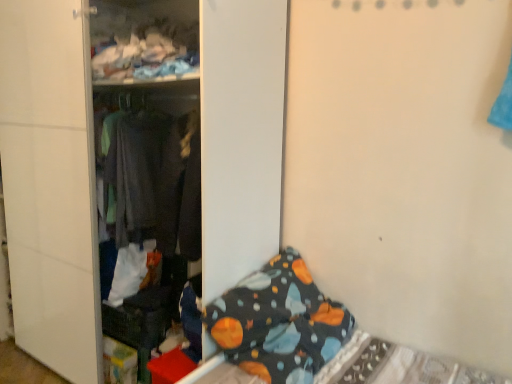
Question: From the image's perspective, is dark blue fabric bed at lower right located above dark blue fabric blanket at lower right?

Choices:
 (A) no
 (B) yes

Answer: (A)

Question: Is dark blue fabric bed at lower right taller than dark blue fabric blanket at lower right?

Choices:
 (A) no
 (B) yes

Answer: (A)

Question: Does dark blue fabric bed at lower right have a larger size compared to dark blue fabric blanket at lower right?

Choices:
 (A) yes
 (B) no

Answer: (B)

Question: From a real-world perspective, is dark blue fabric bed at lower right on top of dark blue fabric blanket at lower right?

Choices:
 (A) no
 (B) yes

Answer: (A)

Question: Is dark blue fabric bed at lower right outside dark blue fabric blanket at lower right?

Choices:
 (A) yes
 (B) no

Answer: (A)

Question: Is dark blue fabric bed at lower right surrounding dark blue fabric blanket at lower right?

Choices:
 (A) yes
 (B) no

Answer: (B)

Question: From the image's perspective, is dark blue fabric blanket at lower right on top of dark gray fabric at center?

Choices:
 (A) no
 (B) yes

Answer: (A)

Question: From a real-world perspective, does dark blue fabric blanket at lower right stand above dark gray fabric at center?

Choices:
 (A) yes
 (B) no

Answer: (B)

Question: Is dark gray fabric at center completely or partially inside dark blue fabric blanket at lower right?

Choices:
 (A) no
 (B) yes

Answer: (B)

Question: Is dark blue fabric blanket at lower right wider than dark gray fabric at center?

Choices:
 (A) no
 (B) yes

Answer: (B)

Question: From the image's perspective, does dark blue fabric blanket at lower right appear lower than dark gray fabric at center?

Choices:
 (A) yes
 (B) no

Answer: (A)

Question: Can you confirm if dark blue fabric blanket at lower right is shorter than dark gray fabric at center?

Choices:
 (A) yes
 (B) no

Answer: (B)

Question: Can you confirm if dark gray fabric at center is taller than dark blue fabric blanket at lower right?

Choices:
 (A) yes
 (B) no

Answer: (B)